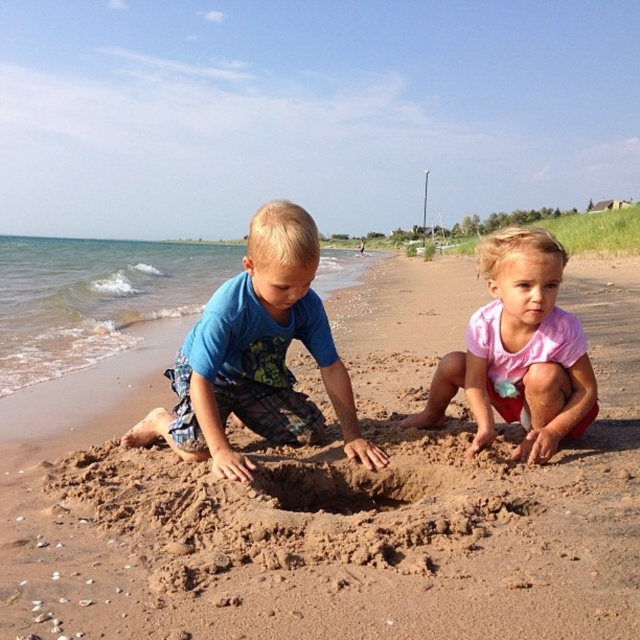
Question: Which point is farther from the camera taking this photo?

Choices:
 (A) [x=541, y=484]
 (B) [x=368, y=465]

Answer: (B)

Question: Observing the image, what is the correct spatial positioning of brown sand at center in reference to pink fabric at center?

Choices:
 (A) left
 (B) right

Answer: (B)

Question: Which point is closer to the camera?

Choices:
 (A) pink fabric at center
 (B) brown sand at center

Answer: (B)

Question: Does brown sand at center appear on the right side of blue cotton shirt at center?

Choices:
 (A) no
 (B) yes

Answer: (B)

Question: Which object appears farthest from the camera in this image?

Choices:
 (A) pink fabric at center
 (B) blue cotton shirt at center
 (C) brown sand at center

Answer: (A)

Question: Is brown sand at center further to the viewer compared to pink fabric at center?

Choices:
 (A) no
 (B) yes

Answer: (A)